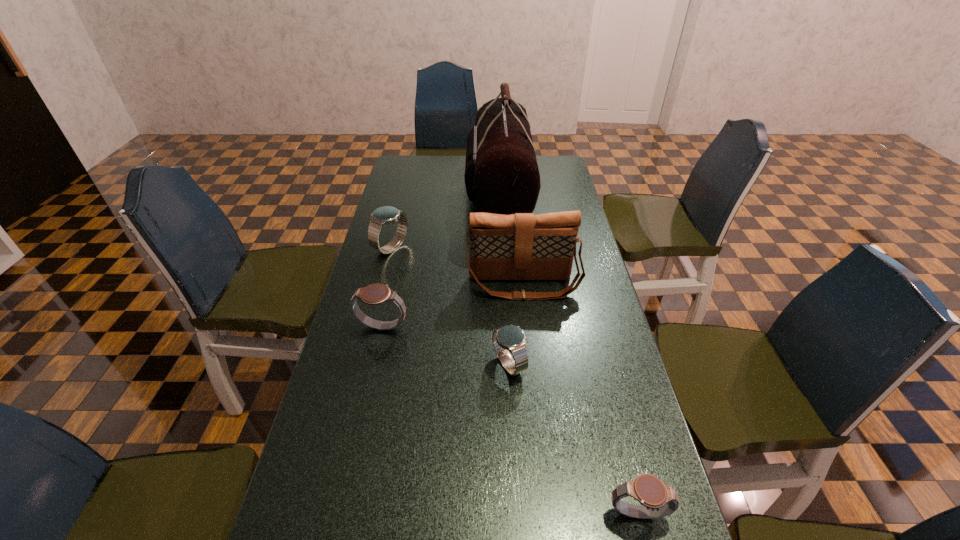
Locate an element on the screen. object present at the far edge is located at coordinates click(x=501, y=175).

Find the location of a particular element. The image size is (960, 540). duffel bag located in the right edge section of the desktop is located at coordinates (501, 175).

At what (x,y) coordinates should I click in order to perform the action: click on shoulder bag that is at the right edge. Please return your answer as a coordinate pair (x, y). The height and width of the screenshot is (540, 960). Looking at the image, I should click on (522, 246).

At what (x,y) coordinates should I click in order to perform the action: click on watch located at the right edge. Please return your answer as a coordinate pair (x, y). The width and height of the screenshot is (960, 540). Looking at the image, I should click on (657, 499).

Where is `object that is at the far right corner`? object that is at the far right corner is located at coordinates (501, 175).

At what (x,y) coordinates should I click in order to perform the action: click on vacant area at the left edge of the desktop. Please return your answer as a coordinate pair (x, y). Looking at the image, I should click on (394, 306).

Where is `free space at the right edge of the desktop`? The height and width of the screenshot is (540, 960). free space at the right edge of the desktop is located at coordinates (589, 391).

Where is `free space at the far left corner of the desktop`? free space at the far left corner of the desktop is located at coordinates (423, 175).

Where is `vacant space at the far right corner of the desktop`? The width and height of the screenshot is (960, 540). vacant space at the far right corner of the desktop is located at coordinates (560, 179).

At what (x,y) coordinates should I click in order to perform the action: click on vacant space that's between the sixth shortest object and the third farthest watch. Please return your answer as a coordinate pair (x, y). The width and height of the screenshot is (960, 540). Looking at the image, I should click on (516, 325).